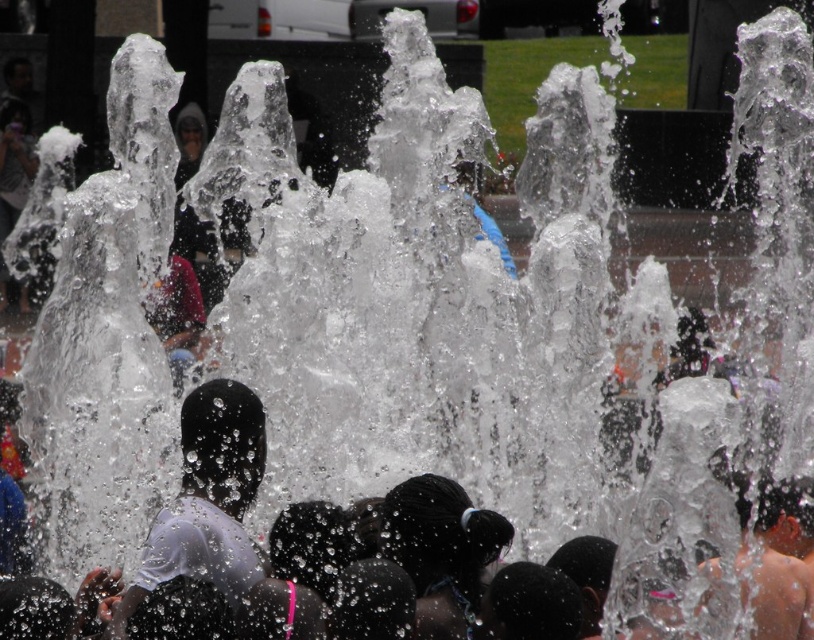
Which of these two, transparent wet hair at center or white matte shirt at center, stands taller?

transparent wet hair at center

Is transparent wet hair at center below white matte shirt at center?

Yes.

Which is in front, point (152, 584) or point (252, 422)?

Positioned in front is point (152, 584).

Locate an element on the screen. transparent wet hair at center is located at coordinates (198, 554).